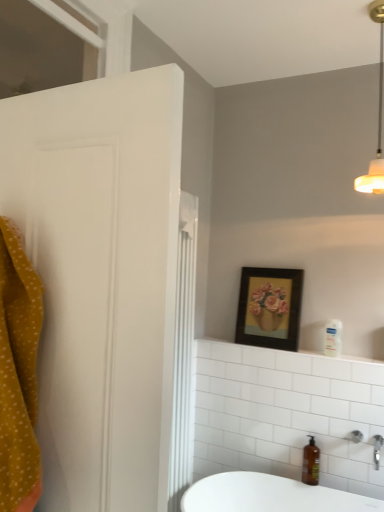
What is the approximate width of brown glass soap dispenser at lower right?

The width of brown glass soap dispenser at lower right is 4.73 inches.

What do you see at coordinates (377, 449) in the screenshot?
I see `silver metallic faucet at lower right` at bounding box center [377, 449].

The width and height of the screenshot is (384, 512). What do you see at coordinates (333, 338) in the screenshot? I see `clear plastic pump bottle at upper right` at bounding box center [333, 338].

You are a GUI agent. You are given a task and a screenshot of the screen. Output one action in this format:
    pyautogui.click(x=<x>, y=<y>)
    Task: Click on the white glossy shelf at upper center
    The image size is (384, 512).
    Given the screenshot: What is the action you would take?
    pyautogui.click(x=369, y=358)

What do you see at coordinates (269, 307) in the screenshot? I see `wooden framed picture at upper center` at bounding box center [269, 307].

Where is `wooden framed picture at upper center`? Image resolution: width=384 pixels, height=512 pixels. wooden framed picture at upper center is located at coordinates (269, 307).

Locate an element on the screen. The height and width of the screenshot is (512, 384). brown glass soap dispenser at lower right is located at coordinates (311, 463).

From the image's perspective, relative to transparent glass window at upper left, is white glossy shelf at upper center above or below?

Based on their image positions, white glossy shelf at upper center is located beneath transparent glass window at upper left.

In the image, is white glossy shelf at upper center positioned in front of or behind transparent glass window at upper left?

Clearly, white glossy shelf at upper center is behind transparent glass window at upper left.

Is white glossy shelf at upper center spatially inside transparent glass window at upper left, or outside of it?

white glossy shelf at upper center is outside transparent glass window at upper left.

Which is in front, point (353, 359) or point (38, 49)?

Point (353, 359)

From a real-world perspective, which is physically below, white glossy shelf at upper center or wooden framed picture at upper center?

white glossy shelf at upper center is physically lower.

From the image's perspective, is white glossy shelf at upper center on wooden framed picture at upper center?

No.

Between white glossy shelf at upper center and wooden framed picture at upper center, which one has larger width?

With larger width is white glossy shelf at upper center.

Measure the distance from white glossy shelf at upper center to wooden framed picture at upper center.

They are 12.82 inches apart.

Which object is wider, wooden framed picture at upper center or white glossy shelf at upper center?

white glossy shelf at upper center.

Considering the positions of point (264, 281) and point (381, 355), is point (264, 281) closer or farther from the camera than point (381, 355)?

Point (264, 281).

Do you think wooden framed picture at upper center is within white glossy shelf at upper center, or outside of it?

wooden framed picture at upper center is not inside white glossy shelf at upper center, it's outside.

Where is `counter top behind the transparent glass window at upper left`? The width and height of the screenshot is (384, 512). counter top behind the transparent glass window at upper left is located at coordinates (369, 358).

From a real-world perspective, is transparent glass window at upper left above or below white glossy shelf at upper center?

transparent glass window at upper left is above white glossy shelf at upper center.

Which is closer to the camera, (48, 27) or (353, 357)?

The point (353, 357) is closer.

Considering the relative sizes of white glossy shelf at upper center and white matte light fixture at upper right in the image provided, is white glossy shelf at upper center smaller than white matte light fixture at upper right?

Yes.

Considering the sizes of objects white glossy shelf at upper center and white matte light fixture at upper right in the image provided, who is taller, white glossy shelf at upper center or white matte light fixture at upper right?

white matte light fixture at upper right.

Locate an element on the screen. counter top that is behind the white matte light fixture at upper right is located at coordinates (369, 358).

From a real-world perspective, who is located lower, white glossy shelf at upper center or white matte light fixture at upper right?

From a 3D spatial view, white glossy shelf at upper center is below.

Which point is more forward, (309, 478) or (381, 446)?

Positioned in front is point (381, 446).

Is brown glass soap dispenser at lower right further to camera compared to silver metallic faucet at lower right?

That is True.

From the image's perspective, would you say brown glass soap dispenser at lower right is positioned over silver metallic faucet at lower right?

No, from the image's perspective, brown glass soap dispenser at lower right is not on top of silver metallic faucet at lower right.

Is brown glass soap dispenser at lower right not close to silver metallic faucet at lower right?

That's not correct — brown glass soap dispenser at lower right is a little close to silver metallic faucet at lower right.

Is brown glass soap dispenser at lower right positioned beyond the bounds of clear plastic pump bottle at upper right?

Yes.

Which object is wider, brown glass soap dispenser at lower right or clear plastic pump bottle at upper right?

With larger width is brown glass soap dispenser at lower right.

Find the location of a particular element. soap dispenser lying below the clear plastic pump bottle at upper right (from the image's perspective) is located at coordinates (311, 463).

Considering the points (305, 474) and (326, 334), which point is in front, point (305, 474) or point (326, 334)?

The point (305, 474) is more forward.

In order to click on counter top that appears below the transparent glass window at upper left (from a real-world perspective) in this screenshot , I will do click(369, 358).

At what (x,y) coordinates should I click in order to perform the action: click on counter top on the right of wooden framed picture at upper center. Please return your answer as a coordinate pair (x, y). Looking at the image, I should click on (369, 358).

Looking at this image, considering their positions, is silver metallic faucet at lower right positioned closer to transparent glass window at upper left than brown glass soap dispenser at lower right?

brown glass soap dispenser at lower right is closer to transparent glass window at upper left.

From the image, which object appears to be nearer to white glossy shelf at upper center, white matte light fixture at upper right or clear plastic pump bottle at upper right?

clear plastic pump bottle at upper right.

Which object lies further to the anchor point wooden framed picture at upper center, silver metallic faucet at lower right or brown glass soap dispenser at lower right?

Based on the image, silver metallic faucet at lower right appears to be further to wooden framed picture at upper center.

Estimate the real-world distances between objects in this image. Which object is closer to wooden framed picture at upper center, brown glass soap dispenser at lower right or white glossy shelf at upper center?

white glossy shelf at upper center is positioned closer to the anchor wooden framed picture at upper center.

Looking at the image, which one is located further to transparent glass window at upper left, silver metallic faucet at lower right or wooden framed picture at upper center?

silver metallic faucet at lower right is further to transparent glass window at upper left.

When comparing their distances from brown glass soap dispenser at lower right, does white matte light fixture at upper right or white glossy shelf at upper center seem closer?

Among the two, white glossy shelf at upper center is located nearer to brown glass soap dispenser at lower right.

When comparing their distances from brown glass soap dispenser at lower right, does white glossy shelf at upper center or clear plastic pump bottle at upper right seem closer?

Based on the image, white glossy shelf at upper center appears to be nearer to brown glass soap dispenser at lower right.

From the image, which object appears to be farther from wooden framed picture at upper center, white glossy shelf at upper center or transparent glass window at upper left?

Based on the image, transparent glass window at upper left appears to be further to wooden framed picture at upper center.

Where is `counter top that lies between wooden framed picture at upper center and brown glass soap dispenser at lower right from top to bottom`? The width and height of the screenshot is (384, 512). counter top that lies between wooden framed picture at upper center and brown glass soap dispenser at lower right from top to bottom is located at coordinates (369, 358).

Find the location of `picture frame that lies between transparent glass window at upper left and brown glass soap dispenser at lower right from top to bottom`. picture frame that lies between transparent glass window at upper left and brown glass soap dispenser at lower right from top to bottom is located at coordinates (269, 307).

Find the location of a particular element. picture frame that lies between white matte light fixture at upper right and silver metallic faucet at lower right from top to bottom is located at coordinates (269, 307).

This screenshot has width=384, height=512. What are the coordinates of `toiletry between white matte light fixture at upper right and brown glass soap dispenser at lower right from top to bottom` in the screenshot? It's located at (333, 338).